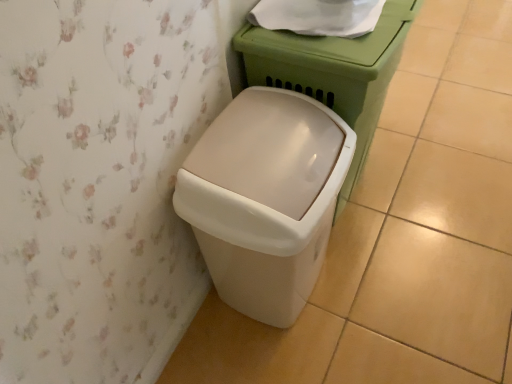
Question: Is white glossy porcelain at center to the right of white paper at upper center from the viewer's perspective?

Choices:
 (A) no
 (B) yes

Answer: (B)

Question: From the image's perspective, is white glossy porcelain at center on white paper at upper center?

Choices:
 (A) no
 (B) yes

Answer: (A)

Question: Can you confirm if white glossy porcelain at center is bigger than white paper at upper center?

Choices:
 (A) yes
 (B) no

Answer: (A)

Question: Is white glossy porcelain at center in front of white paper at upper center?

Choices:
 (A) no
 (B) yes

Answer: (B)

Question: From a real-world perspective, does white glossy porcelain at center stand above white paper at upper center?

Choices:
 (A) yes
 (B) no

Answer: (B)

Question: Does white glossy porcelain at center come behind white paper at upper center?

Choices:
 (A) no
 (B) yes

Answer: (A)

Question: Is white paper at upper center behind beige plastic waste container at lower left?

Choices:
 (A) no
 (B) yes

Answer: (B)

Question: Would you say white paper at upper center is outside beige plastic waste container at lower left?

Choices:
 (A) no
 (B) yes

Answer: (B)

Question: Does white paper at upper center touch beige plastic waste container at lower left?

Choices:
 (A) no
 (B) yes

Answer: (A)

Question: Are white paper at upper center and beige plastic waste container at lower left far apart?

Choices:
 (A) no
 (B) yes

Answer: (A)

Question: Does white paper at upper center have a lesser width compared to beige plastic waste container at lower left?

Choices:
 (A) yes
 (B) no

Answer: (A)

Question: Is beige plastic waste container at lower left located within white paper at upper center?

Choices:
 (A) no
 (B) yes

Answer: (A)

Question: From a real-world perspective, is beige plastic waste container at lower left beneath white paper at upper center?

Choices:
 (A) no
 (B) yes

Answer: (B)